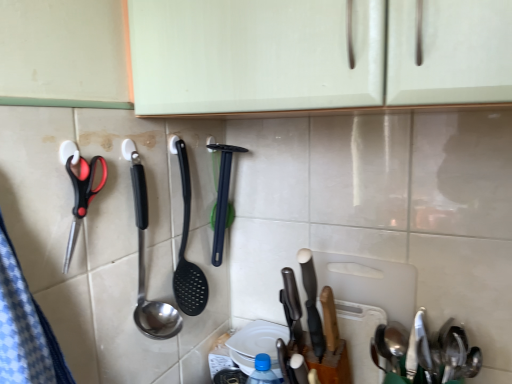
Question: Does black plastic spatula at center have a greater width compared to satin silver spoon at lower right, the second spoon viewed from the top?

Choices:
 (A) no
 (B) yes

Answer: (A)

Question: Considering the relative sizes of black plastic spatula at center and satin silver spoon at lower right, the second spoon viewed from the top, in the image provided, is black plastic spatula at center thinner than satin silver spoon at lower right, the second spoon viewed from the top,?

Choices:
 (A) no
 (B) yes

Answer: (B)

Question: Is black plastic spatula at center beside satin silver spoon at lower right, the second spoon viewed from the top?

Choices:
 (A) yes
 (B) no

Answer: (B)

Question: Considering the relative positions of black plastic spatula at center and satin silver spoon at lower right, the second spoon viewed from the top, in the image provided, is black plastic spatula at center to the left of satin silver spoon at lower right, the second spoon viewed from the top, from the viewer's perspective?

Choices:
 (A) yes
 (B) no

Answer: (A)

Question: From a real-world perspective, is black plastic spatula at center physically below satin silver spoon at lower right, the second spoon viewed from the top?

Choices:
 (A) no
 (B) yes

Answer: (A)

Question: Relative to white matte cutting board at center-right, is white glossy plate at center in front or behind?

Choices:
 (A) behind
 (B) front

Answer: (A)

Question: Visually, is white glossy plate at center positioned to the left or to the right of white matte cutting board at center-right?

Choices:
 (A) left
 (B) right

Answer: (A)

Question: Based on their sizes in the image, would you say white glossy plate at center is bigger or smaller than white matte cutting board at center-right?

Choices:
 (A) big
 (B) small

Answer: (B)

Question: In terms of width, does white glossy plate at center look wider or thinner when compared to white matte cutting board at center-right?

Choices:
 (A) wide
 (B) thin

Answer: (A)

Question: From the image's perspective, is white matte cutting board at center-right located above or below white glossy plate at center?

Choices:
 (A) below
 (B) above

Answer: (B)

Question: Is white matte cutting board at center-right to the left or to the right of white glossy plate at center in the image?

Choices:
 (A) left
 (B) right

Answer: (B)

Question: Considering their positions, is white matte cutting board at center-right located in front of or behind white glossy plate at center?

Choices:
 (A) front
 (B) behind

Answer: (A)

Question: Looking at the image, does white matte cutting board at center-right seem bigger or smaller compared to white glossy plate at center?

Choices:
 (A) big
 (B) small

Answer: (A)

Question: Is white matte cutting board at center-right situated inside polished stainless steel spoon at center, which is counted as the first spoon, starting from the left, or outside?

Choices:
 (A) outside
 (B) inside

Answer: (A)

Question: From the image's perspective, is white matte cutting board at center-right above or below polished stainless steel spoon at center, the second spoon from the bottom?

Choices:
 (A) above
 (B) below

Answer: (B)